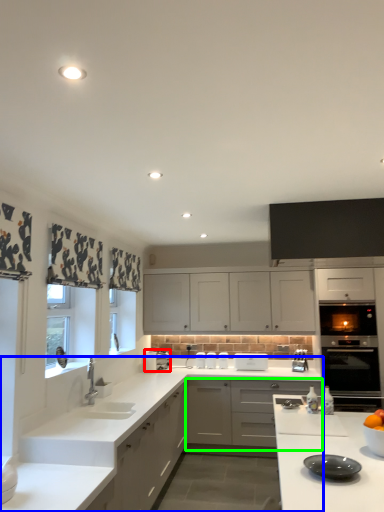
Question: Considering the real-world distances, which object is farthest from appliance (highlighted by a red box)? countertop (highlighted by a blue box) or cabinetry (highlighted by a green box)?

Choices:
 (A) countertop
 (B) cabinetry

Answer: (A)